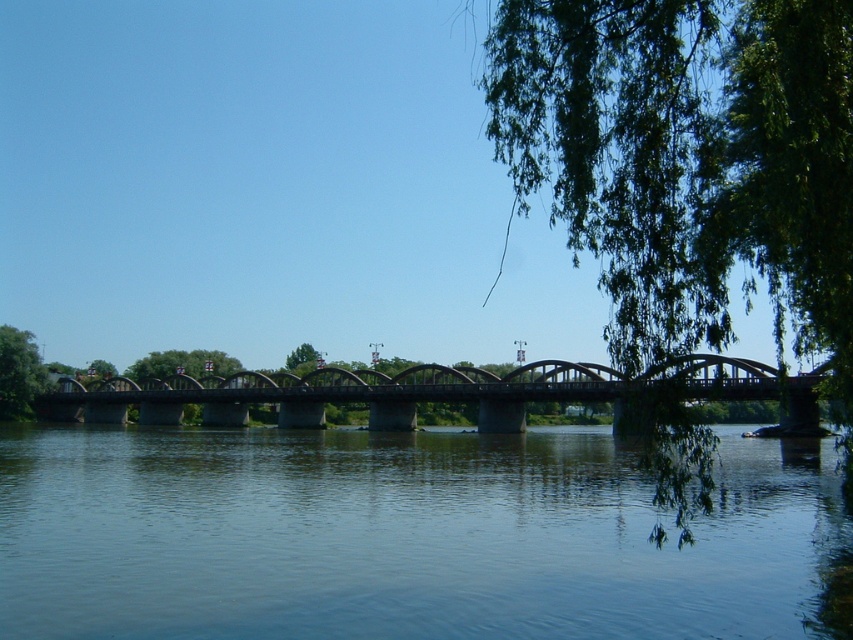
Question: Is clear blue water at center above concrete bridge at center?

Choices:
 (A) yes
 (B) no

Answer: (B)

Question: Does green leafy tree at upper right appear on the left side of green leafy tree at left?

Choices:
 (A) no
 (B) yes

Answer: (A)

Question: Among these points, which one is farthest from the camera?

Choices:
 (A) (518, 211)
 (B) (488, 387)
 (C) (776, 621)

Answer: (A)

Question: Can you confirm if clear blue water at center is positioned above green leafy tree at center?

Choices:
 (A) no
 (B) yes

Answer: (A)

Question: Which of the following is the closest to the observer?

Choices:
 (A) (329, 396)
 (B) (627, 29)

Answer: (B)

Question: Considering the real-world distances, which object is farthest from the clear blue water at center?

Choices:
 (A) green leafy tree at upper right
 (B) concrete bridge at center
 (C) green leafy tree at left
 (D) green leafy tree at center

Answer: (C)